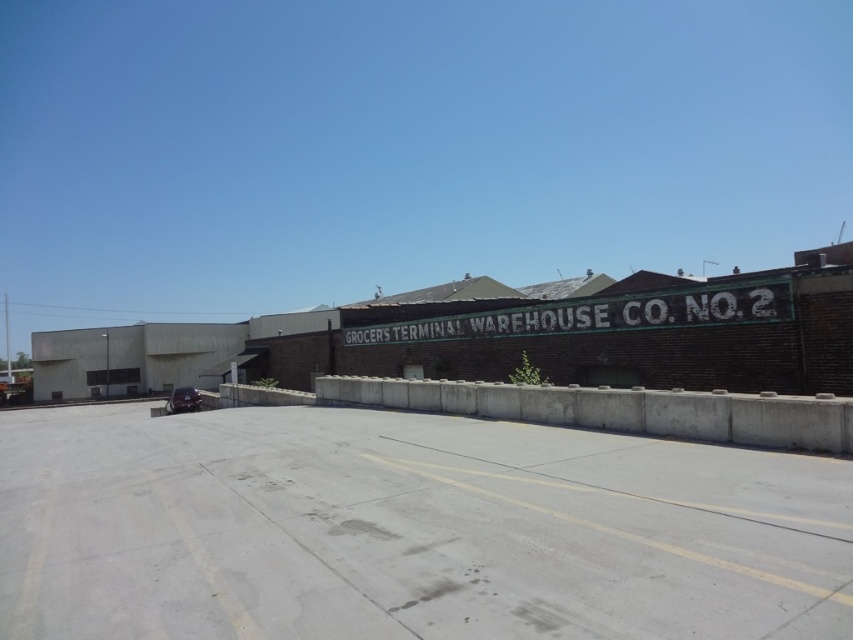
You are a delivery driver who needs to park your shiny black car at lower left without blocking the white painted metal sign at center. Is this possible given their current positions?

The white painted metal sign at center is positioned over the shiny black car at lower left, meaning the car is already under the sign. To park without blocking it, you would need to move the car away from directly underneath the sign.

You are a delivery driver who needs to park your shiny black car at lower left near the white painted metal sign at center. Can you park your car close enough so that the sign is visible from the driver seat without moving your head?

The white painted metal sign at center has a lesser height compared to shiny black car at lower left. Since the sign is shorter, it should be visible from the driver seat as long as the car is parked close enough.

Looking at this image, you are a delivery driver who needs to park your truck in the parking area marked by the faded yellow lines. You see the white painted metal sign at center and the shiny black car at lower left. Which object takes up more horizontal space in the image?

The shiny black car at lower left has a greater width than the white painted metal sign at center, so the shiny black car at lower left takes up more horizontal space in the image.